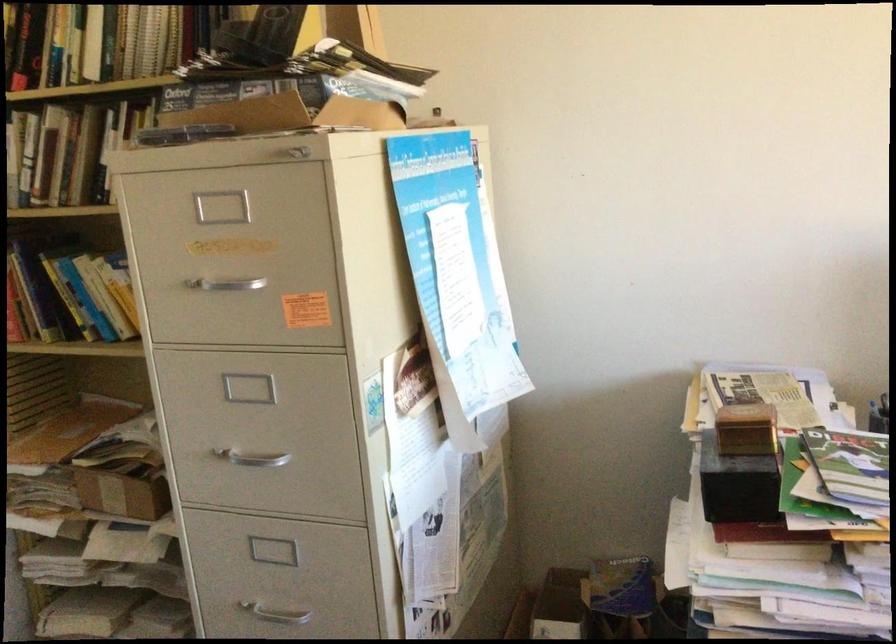
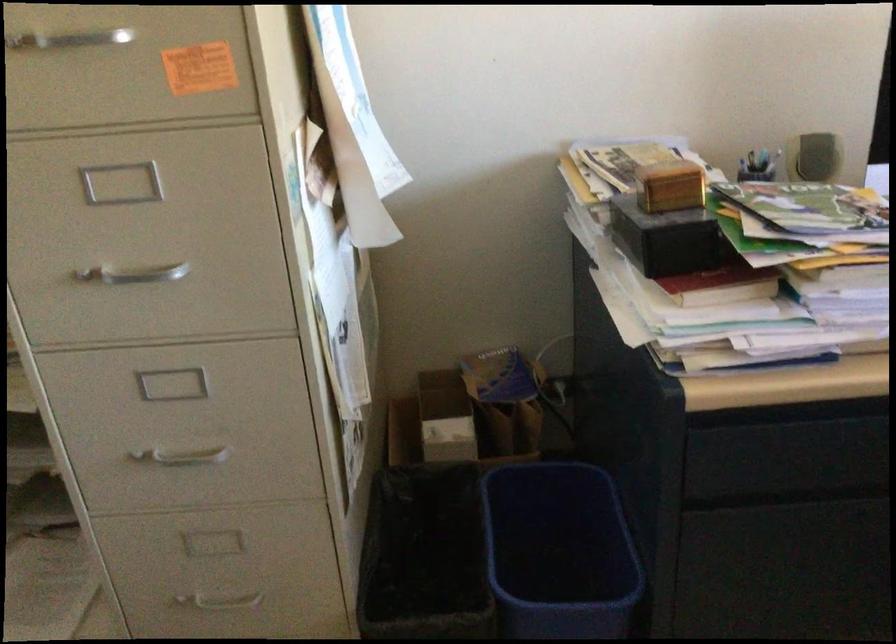
Find the pixel in the second image that matches (x=743, y=429) in the first image.

(669, 185)